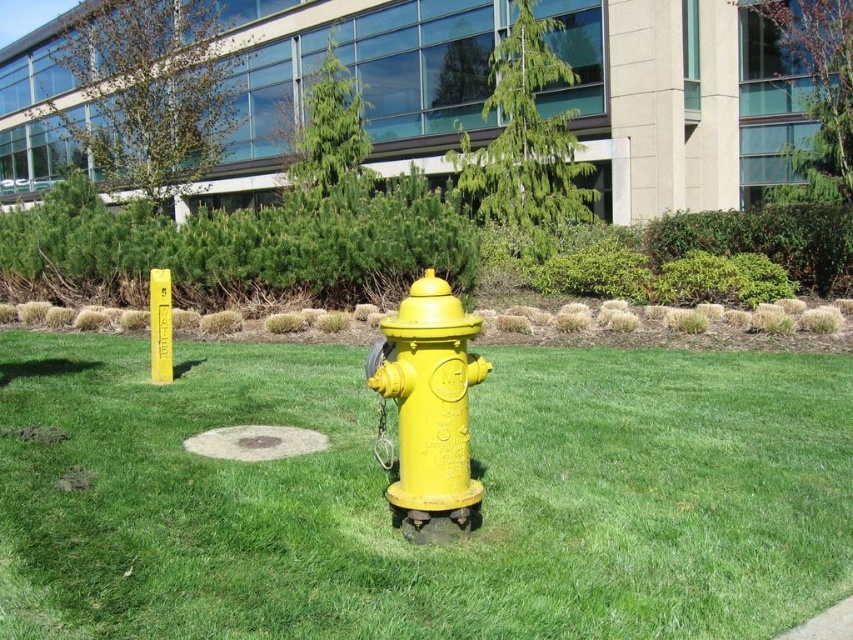
Can you confirm if green grass at center is wider than yellow matte pole at center?

Indeed, green grass at center has a greater width compared to yellow matte pole at center.

Which of these two, green grass at center or yellow matte pole at center, stands taller?

Standing taller between the two is yellow matte pole at center.

I want to click on green grass at center, so click(387, 506).

Is yellow matte fire hydrant at center shorter than gray concrete sidewalk at lower right?

In fact, yellow matte fire hydrant at center may be taller than gray concrete sidewalk at lower right.

Which of these two, yellow matte fire hydrant at center or gray concrete sidewalk at lower right, stands shorter?

Standing shorter between the two is gray concrete sidewalk at lower right.

This screenshot has height=640, width=853. Identify the location of yellow matte fire hydrant at center. (428, 410).

Can you confirm if green grass at center is wider than gray concrete sidewalk at lower right?

No, green grass at center is not wider than gray concrete sidewalk at lower right.

The image size is (853, 640). I want to click on green grass at center, so click(387, 506).

Between point (16, 456) and point (821, 625), which one is positioned behind?

The point (16, 456) is behind.

You are a GUI agent. You are given a task and a screenshot of the screen. Output one action in this format:
    pyautogui.click(x=<x>, y=<y>)
    Task: Click on the green grass at center
    
    Given the screenshot: What is the action you would take?
    pyautogui.click(x=387, y=506)